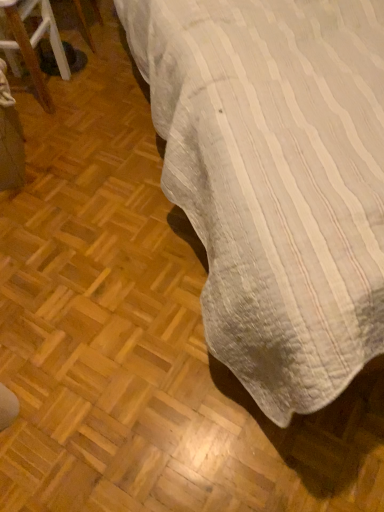
The image size is (384, 512). Identify the location of free space in front of black fabric bag at left. (59, 135).